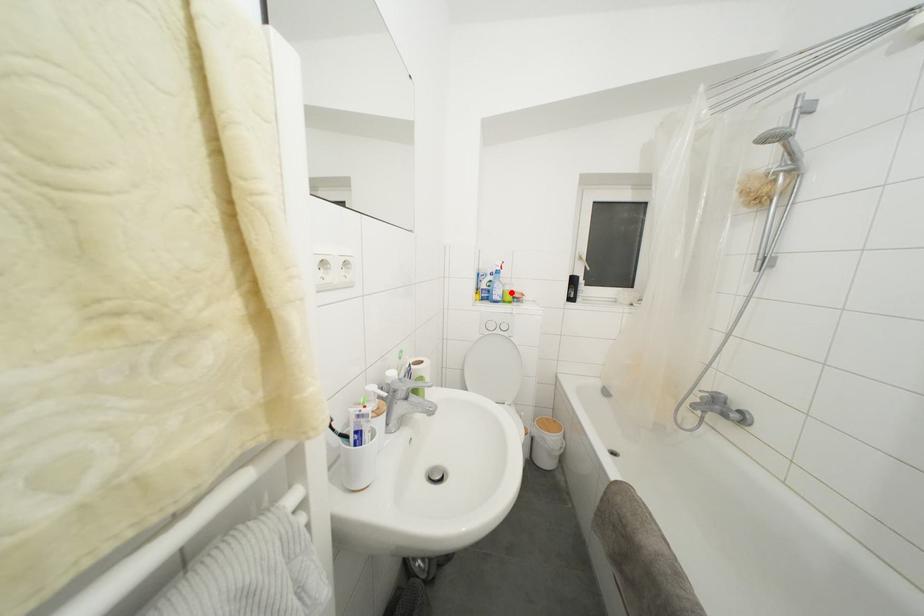
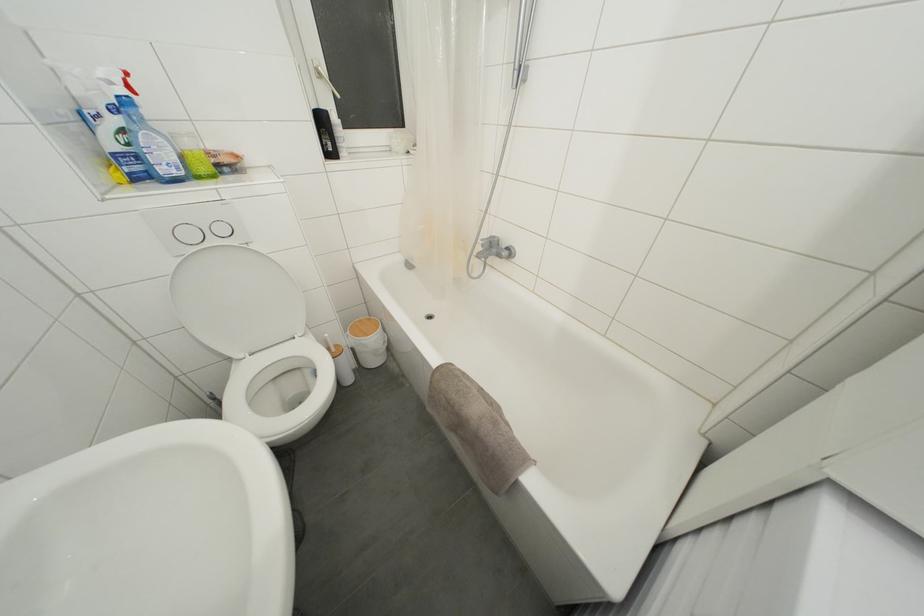
In the second image, find the point that corresponds to the highlighted location in the first image.

(193, 148)